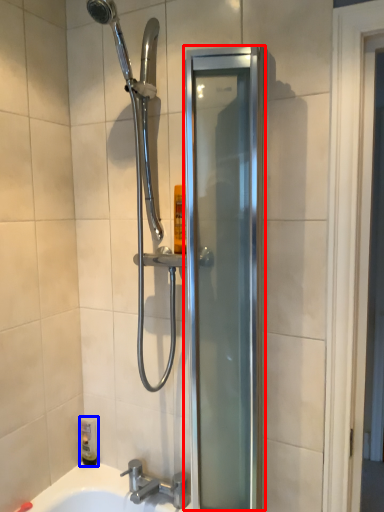
Question: Which object appears farthest to the camera in this image, screen door (highlighted by a red box) or toiletry (highlighted by a blue box)?

Choices:
 (A) screen door
 (B) toiletry

Answer: (B)